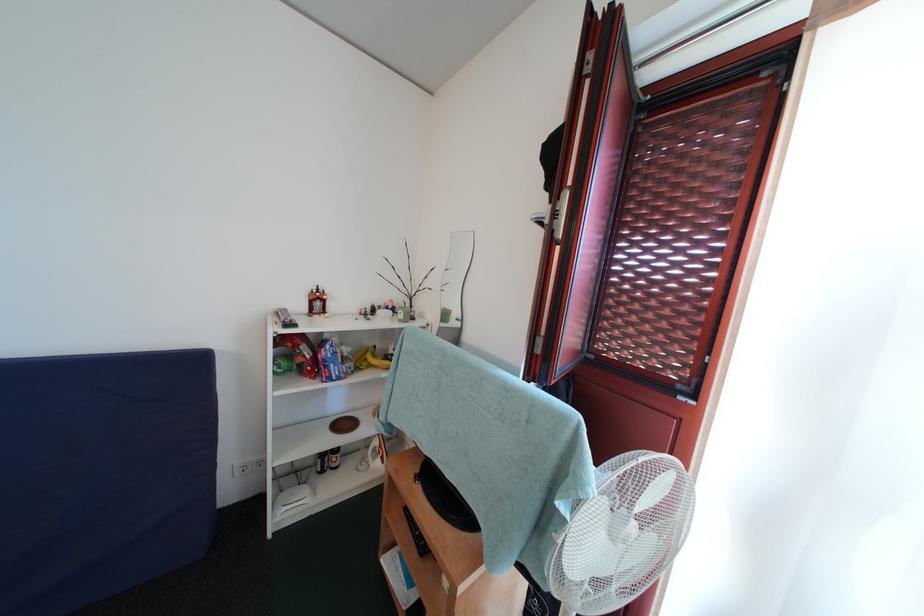
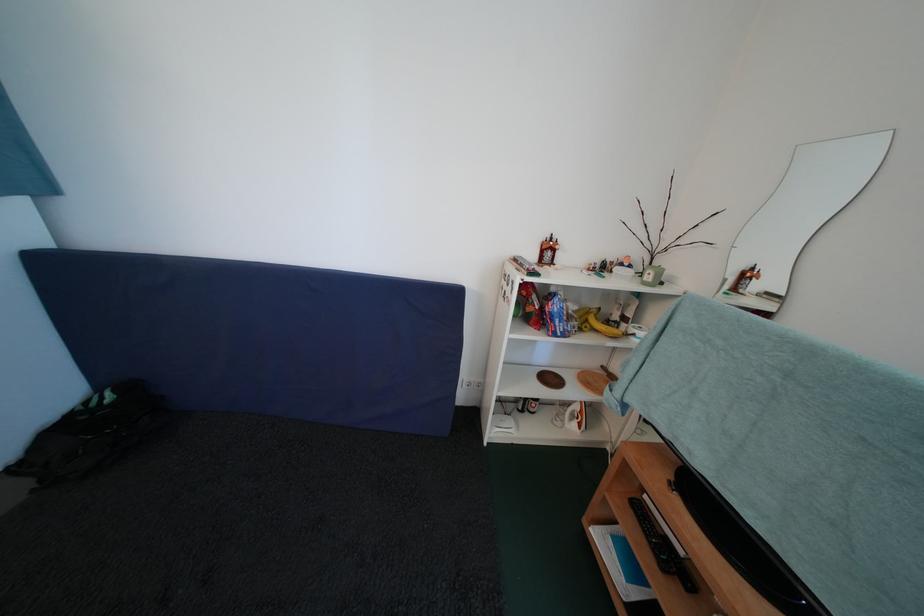
In the second image, find the point that corresponds to (350,430) in the first image.

(556, 384)